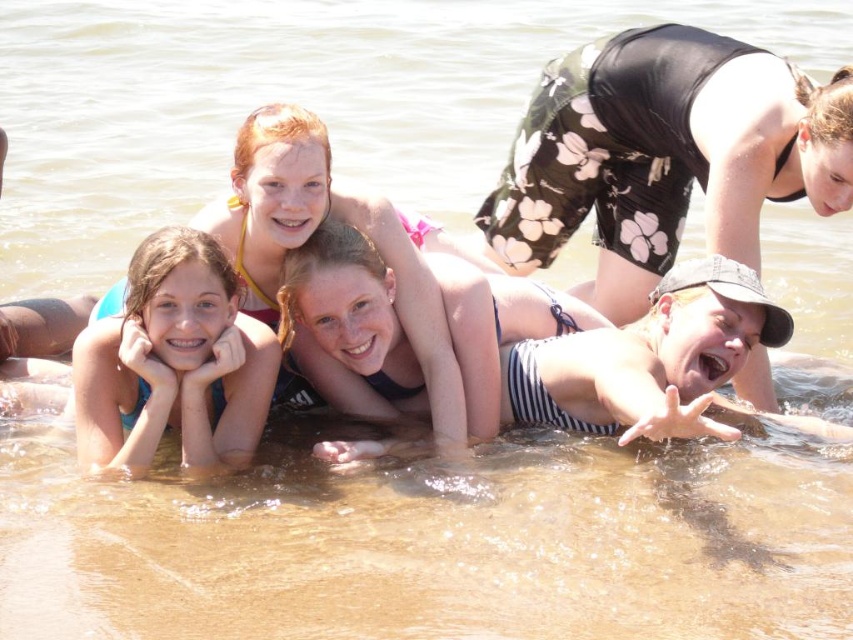
Question: Can you confirm if striped swimsuit at center is smaller than blue fabric at lower left?

Choices:
 (A) no
 (B) yes

Answer: (A)

Question: Does striped swimsuit at center have a larger size compared to blue fabric at lower left?

Choices:
 (A) no
 (B) yes

Answer: (B)

Question: Is striped swimsuit at center further to the viewer compared to blue fabric at lower left?

Choices:
 (A) no
 (B) yes

Answer: (B)

Question: Which point is closer to the camera taking this photo?

Choices:
 (A) (131, 276)
 (B) (722, 241)

Answer: (A)

Question: Which point is closer to the camera taking this photo?

Choices:
 (A) (778, 166)
 (B) (192, 278)

Answer: (B)